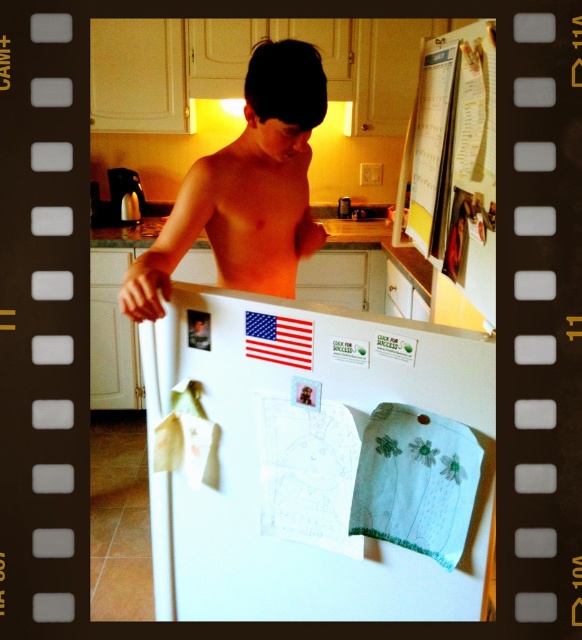
Which of these two, white matte refrigerator at center or pinkish flesh muscle at center, stands shorter?

pinkish flesh muscle at center is shorter.

Is white matte refrigerator at center smaller than pinkish flesh muscle at center?

No, white matte refrigerator at center is not smaller than pinkish flesh muscle at center.

Describe the element at coordinates (314, 461) in the screenshot. I see `white matte refrigerator at center` at that location.

The image size is (582, 640). In order to click on white matte refrigerator at center in this screenshot , I will do `click(314, 461)`.

Based on the photo, does white matte refrigerator at center have a larger size compared to shiny skin at center?

No, white matte refrigerator at center is not bigger than shiny skin at center.

Can you confirm if white matte refrigerator at center is shorter than shiny skin at center?

Yes.

Describe the element at coordinates (314, 461) in the screenshot. This screenshot has height=640, width=582. I see `white matte refrigerator at center` at that location.

This screenshot has height=640, width=582. I want to click on white matte refrigerator at center, so click(314, 461).

Does shiny skin at center appear under pinkish flesh muscle at center?

No.

Who is positioned more to the left, shiny skin at center or pinkish flesh muscle at center?

From the viewer's perspective, shiny skin at center appears more on the left side.

Locate an element on the screen. The width and height of the screenshot is (582, 640). shiny skin at center is located at coordinates (246, 189).

Identify the location of shiny skin at center. (246, 189).